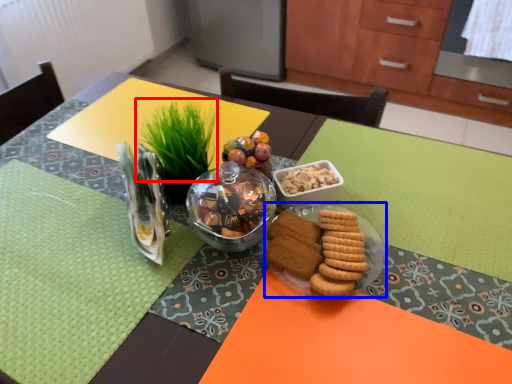
Question: Which object is further to the camera taking this photo, grass (highlighted by a red box) or glass plate (highlighted by a blue box)?

Choices:
 (A) grass
 (B) glass plate

Answer: (A)